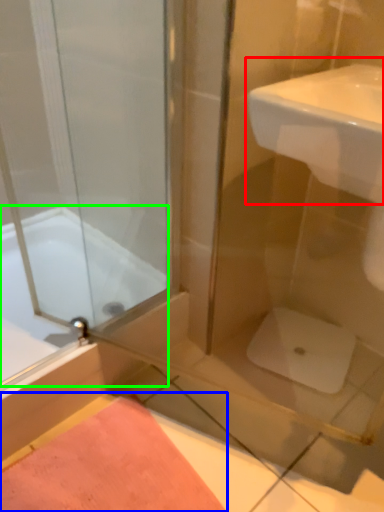
Question: Which object is positioned closest to sink (highlighted by a red box)? Select from bath mat (highlighted by a blue box) and bathtub (highlighted by a green box).

Choices:
 (A) bath mat
 (B) bathtub

Answer: (B)